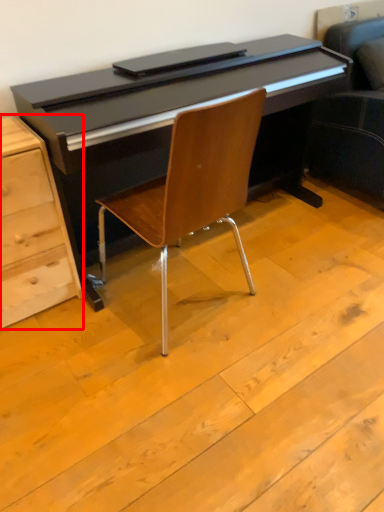
Question: From the image's perspective, where is chest of drawers (annotated by the red box) located in relation to chair in the image?

Choices:
 (A) above
 (B) below

Answer: (B)